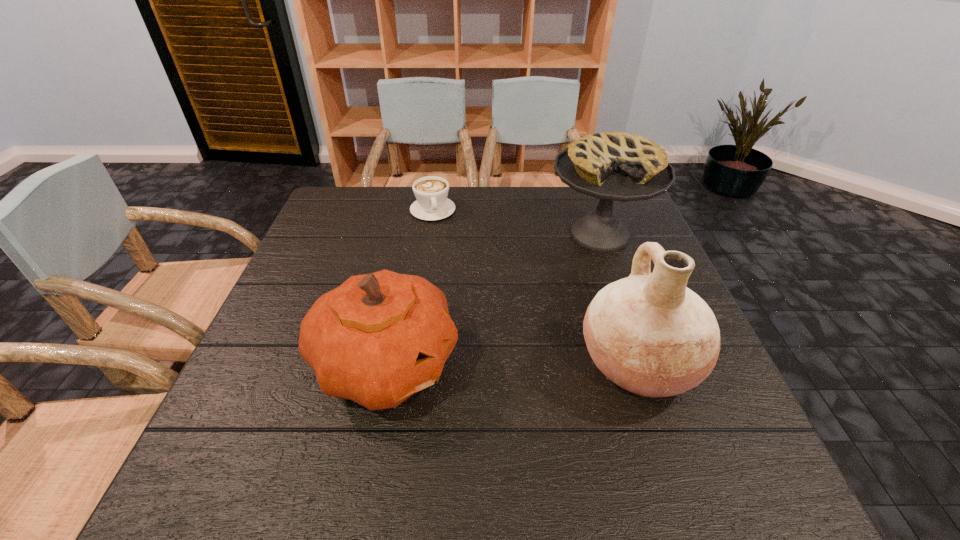
Where is `pumpkin`? pumpkin is located at coordinates (378, 338).

Locate an element on the screen. This screenshot has height=540, width=960. pottery is located at coordinates (648, 333).

Where is `pie`? This screenshot has width=960, height=540. pie is located at coordinates (612, 166).

Identify the location of cappuccino. (431, 192).

The image size is (960, 540). I want to click on free space located on the front-facing side of the pumpkin, so click(532, 364).

Locate an element on the screen. This screenshot has height=540, width=960. free space located on the cut side of the pie is located at coordinates (543, 362).

Identify the location of free space located on the cut side of the pie. The image size is (960, 540). [x=544, y=359].

The height and width of the screenshot is (540, 960). Identify the location of vacant region located on the cut side of the pie. (558, 330).

Where is `vacant area located to the right of the cappuccino's handle`? This screenshot has height=540, width=960. vacant area located to the right of the cappuccino's handle is located at coordinates (456, 280).

Find the location of a particular element. free space located to the right of the cappuccino's handle is located at coordinates (458, 285).